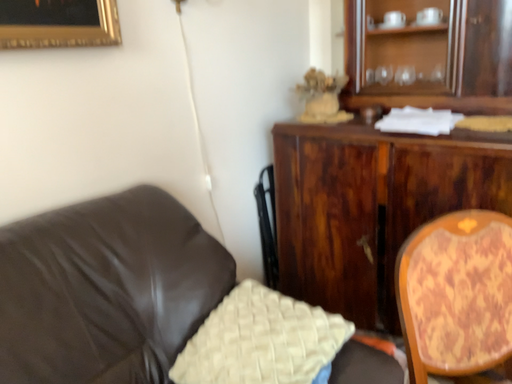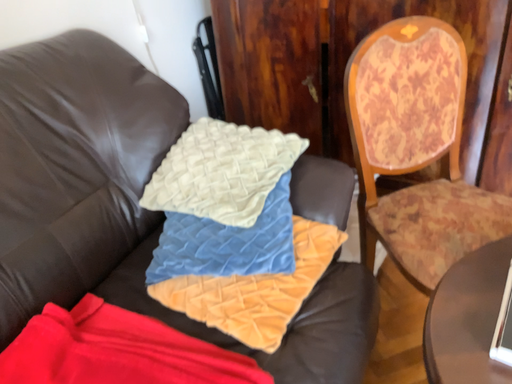
Question: Which way did the camera rotate in the video?

Choices:
 (A) rotated downward
 (B) rotated upward

Answer: (A)